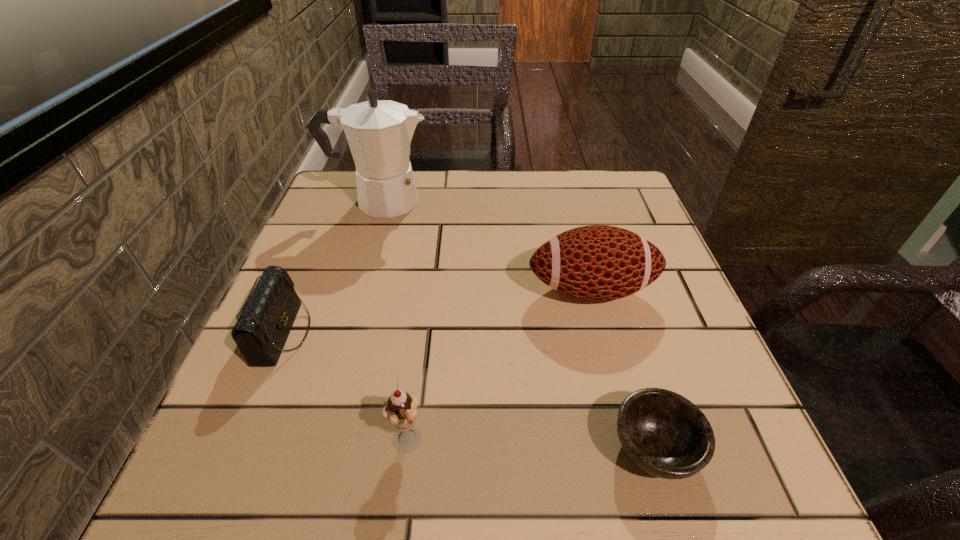
This screenshot has height=540, width=960. Find the location of `vacant area in the image that satisfies the following two spatial constraints: 1. at the spout of the football; 2. on the right side of the farthest object`. vacant area in the image that satisfies the following two spatial constraints: 1. at the spout of the football; 2. on the right side of the farthest object is located at coordinates (352, 290).

Find the location of a particular element. The image size is (960, 540). free space that satisfies the following two spatial constraints: 1. on the front flap of the second shortest object; 2. on the right side of the icecream is located at coordinates (237, 442).

Where is `free spot that satisfies the following two spatial constraints: 1. on the front side of the icecream; 2. on the right side of the bowl`? The width and height of the screenshot is (960, 540). free spot that satisfies the following two spatial constraints: 1. on the front side of the icecream; 2. on the right side of the bowl is located at coordinates (406, 448).

Locate an element on the screen. This screenshot has width=960, height=540. free space that satisfies the following two spatial constraints: 1. at the spout of the tallest object; 2. on the right side of the football is located at coordinates (352, 290).

Where is `vacant point that satisfies the following two spatial constraints: 1. on the front flap of the shortest object; 2. on the right side of the clutch bag`? vacant point that satisfies the following two spatial constraints: 1. on the front flap of the shortest object; 2. on the right side of the clutch bag is located at coordinates (235, 448).

Locate an element on the screen. free space in the image that satisfies the following two spatial constraints: 1. at the spout of the tallest object; 2. on the right side of the shortest object is located at coordinates (305, 448).

The image size is (960, 540). I want to click on vacant position in the image that satisfies the following two spatial constraints: 1. on the front flap of the clutch bag; 2. on the back side of the shortest object, so click(235, 448).

Identify the location of free region that satisfies the following two spatial constraints: 1. at the spout of the coffeepot; 2. on the back side of the football. (352, 290).

The width and height of the screenshot is (960, 540). In order to click on blank space that satisfies the following two spatial constraints: 1. on the back side of the icecream; 2. at the spout of the tallest object in this screenshot , I will do `click(438, 201)`.

Where is `vacant region that satisfies the following two spatial constraints: 1. at the spout of the coffeepot; 2. on the right side of the bowl`? Image resolution: width=960 pixels, height=540 pixels. vacant region that satisfies the following two spatial constraints: 1. at the spout of the coffeepot; 2. on the right side of the bowl is located at coordinates (x=305, y=448).